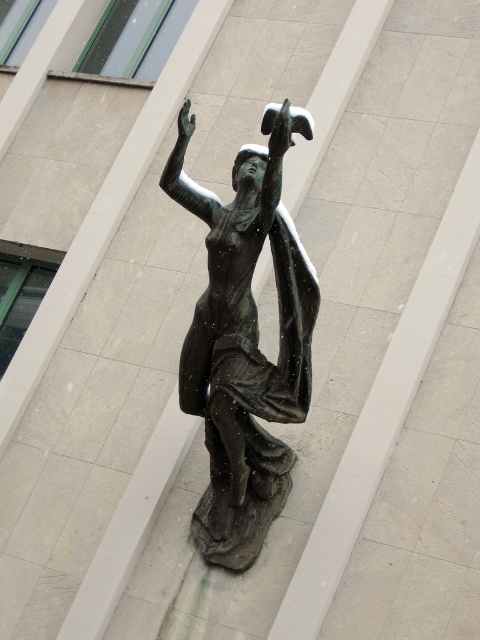
Question: Is bronze statue at center above bronze/golden at upper center?

Choices:
 (A) yes
 (B) no

Answer: (B)

Question: Does bronze statue at center have a lesser width compared to bronze/golden at upper center?

Choices:
 (A) yes
 (B) no

Answer: (B)

Question: Which object is farther from the camera taking this photo?

Choices:
 (A) bronze/golden at upper center
 (B) bronze statue at center

Answer: (A)

Question: Is bronze statue at center closer to the viewer compared to bronze/golden at upper center?

Choices:
 (A) no
 (B) yes

Answer: (B)

Question: Which point is farther to the camera?

Choices:
 (A) bronze statue at center
 (B) bronze/golden at upper center

Answer: (B)